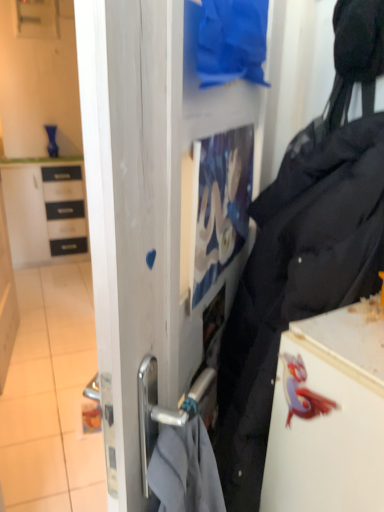
Consider the image. Measure the distance between white glossy tile at lower left and camera.

The depth of white glossy tile at lower left is 5.57 feet.

The height and width of the screenshot is (512, 384). Describe the element at coordinates (329, 415) in the screenshot. I see `white glossy fridge at lower right` at that location.

What do you see at coordinates (298, 272) in the screenshot? The height and width of the screenshot is (512, 384). I see `black matte tote bag at center-right` at bounding box center [298, 272].

You are a GUI agent. You are given a task and a screenshot of the screen. Output one action in this format:
    pyautogui.click(x=<x>, y=<y>)
    Task: Click on the transparent glass door at center
    
    Given the screenshot: What is the action you would take?
    pyautogui.click(x=165, y=229)

Locate an element on the screen. white glossy cabinet at left is located at coordinates (45, 212).

From the image's perspective, between transparent glass door at center and white glossy fridge at lower right, which one is located above?

From the image's view, transparent glass door at center is above.

Is transparent glass door at center wider than white glossy fridge at lower right?

No.

Is transparent glass door at center touching white glossy fridge at lower right?

No, transparent glass door at center is not beside white glossy fridge at lower right.

This screenshot has width=384, height=512. Find the location of `fridge behind the transparent glass door at center`. fridge behind the transparent glass door at center is located at coordinates (329, 415).

Is black matte tote bag at center-right facing towards transparent glass door at center?

Yes.

Considering the sizes of objects black matte tote bag at center-right and transparent glass door at center in the image provided, who is taller, black matte tote bag at center-right or transparent glass door at center?

With more height is black matte tote bag at center-right.

From the image's perspective, is black matte tote bag at center-right located above transparent glass door at center?

No, from the image's perspective, black matte tote bag at center-right is not above transparent glass door at center.

How many degrees apart are the facing directions of black matte tote bag at center-right and transparent glass door at center?

The angular difference between black matte tote bag at center-right and transparent glass door at center is 50.7 degrees.

Does white glossy tile at lower left have a larger size compared to blue fabric at upper center?

Correct, white glossy tile at lower left is larger in size than blue fabric at upper center.

Is blue fabric at upper center completely or partially inside white glossy tile at lower left?

No, blue fabric at upper center is not inside white glossy tile at lower left.

Where is `clothing lying on the right of white glossy tile at lower left`? Image resolution: width=384 pixels, height=512 pixels. clothing lying on the right of white glossy tile at lower left is located at coordinates (232, 41).

Based on the photo, which is more to the right, white glossy tile at lower left or blue fabric at upper center?

blue fabric at upper center.

Is white glossy tile at lower left a part of white glossy fridge at lower right?

Actually, white glossy tile at lower left is outside white glossy fridge at lower right.

At what (x,y) coordinates should I click in order to perform the action: click on tile below the white glossy fridge at lower right (from the image's perspective). Please return your answer as a coordinate pair (x, y). Looking at the image, I should click on (51, 396).

Which of these two, white glossy fridge at lower right or white glossy tile at lower left, is bigger?

With larger size is white glossy fridge at lower right.

Does point (333, 336) come farther from viewer compared to point (83, 450)?

No, it is not.

Which of these two, white glossy fridge at lower right or blue fabric at upper center, is wider?

white glossy fridge at lower right is wider.

Based on the photo, can you tell me how much white glossy fridge at lower right and blue fabric at upper center differ in facing direction?

white glossy fridge at lower right and blue fabric at upper center are facing 52.8 degrees away from each other.

Looking at this image, considering the relative positions of white glossy fridge at lower right and blue fabric at upper center in the image provided, is white glossy fridge at lower right to the left of blue fabric at upper center from the viewer's perspective?

No.

In terms of size, does white glossy fridge at lower right appear bigger or smaller than blue fabric at upper center?

In the image, white glossy fridge at lower right appears to be larger than blue fabric at upper center.

How much distance is there between white glossy fridge at lower right and transparent glass door at center?

white glossy fridge at lower right is 10.01 inches away from transparent glass door at center.

From a real-world perspective, which object rests below the other?

white glossy fridge at lower right.

From their relative heights in the image, would you say white glossy fridge at lower right is taller or shorter than transparent glass door at center?

In the image, white glossy fridge at lower right appears to be shorter than transparent glass door at center.

Is white glossy fridge at lower right aimed at transparent glass door at center?

No, white glossy fridge at lower right is not turned towards transparent glass door at center.

Between point (66, 397) and point (335, 411), which one is positioned in front?

The point (335, 411) is closer.

From the picture: Based on their positions, is white glossy tile at lower left located to the left or right of white glossy fridge at lower right?

Based on their positions, white glossy tile at lower left is located to the left of white glossy fridge at lower right.

Is white glossy tile at lower left in front of or behind white glossy fridge at lower right in the image?

Visually, white glossy tile at lower left is located behind white glossy fridge at lower right.

Image resolution: width=384 pixels, height=512 pixels. Find the location of `glass door in front of the white glossy fridge at lower right`. glass door in front of the white glossy fridge at lower right is located at coordinates (165, 229).

The height and width of the screenshot is (512, 384). In order to click on tote bag on the right side of transparent glass door at center in this screenshot , I will do click(298, 272).

Estimate the real-world distances between objects in this image. Which object is closer to transparent glass door at center, blue fabric at upper center or white glossy fridge at lower right?

blue fabric at upper center.

From the image, which object appears to be farther from black matte tote bag at center-right, white glossy tile at lower left or white glossy cabinet at left?

white glossy cabinet at left.

Looking at the image, which one is located closer to white glossy fridge at lower right, white glossy tile at lower left or transparent glass door at center?

The object closer to white glossy fridge at lower right is transparent glass door at center.

From the image, which object appears to be nearer to white glossy fridge at lower right, blue fabric at upper center or black matte tote bag at center-right?

black matte tote bag at center-right.

From the image, which object appears to be farther from blue fabric at upper center, white glossy tile at lower left or black matte tote bag at center-right?

white glossy tile at lower left lies further to blue fabric at upper center than the other object.

Based on their spatial positions, is white glossy tile at lower left or transparent glass door at center closer to black matte tote bag at center-right?

transparent glass door at center is closer to black matte tote bag at center-right.

From the image, which object appears to be nearer to white glossy cabinet at left, white glossy fridge at lower right or white glossy tile at lower left?

white glossy tile at lower left is closer to white glossy cabinet at left.

Based on their spatial positions, is white glossy cabinet at left or white glossy tile at lower left further from black matte tote bag at center-right?

white glossy cabinet at left is further to black matte tote bag at center-right.

Find the location of a particular element. This screenshot has width=384, height=512. clothing between transparent glass door at center and white glossy cabinet at left along the z-axis is located at coordinates click(x=232, y=41).

Locate an element on the screen. tile between white glossy fridge at lower right and white glossy cabinet at left along the z-axis is located at coordinates (51, 396).

At what (x,y) coordinates should I click in order to perform the action: click on fridge between transparent glass door at center and white glossy cabinet at left from front to back. Please return your answer as a coordinate pair (x, y). This screenshot has height=512, width=384. Looking at the image, I should click on (329, 415).

Image resolution: width=384 pixels, height=512 pixels. In order to click on tote bag that lies between transparent glass door at center and white glossy fridge at lower right from top to bottom in this screenshot , I will do click(298, 272).